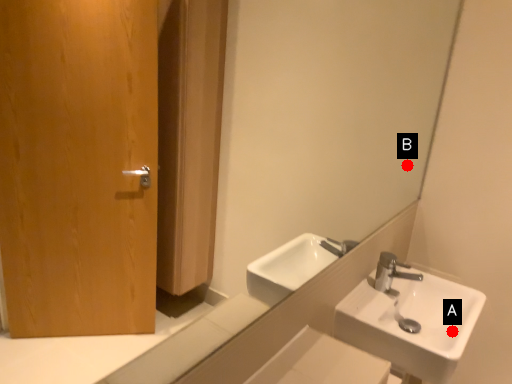
Question: Two points are circled on the image, labeled by A and B beside each circle. Which point is further to the camera?

Choices:
 (A) A is further
 (B) B is further

Answer: (B)